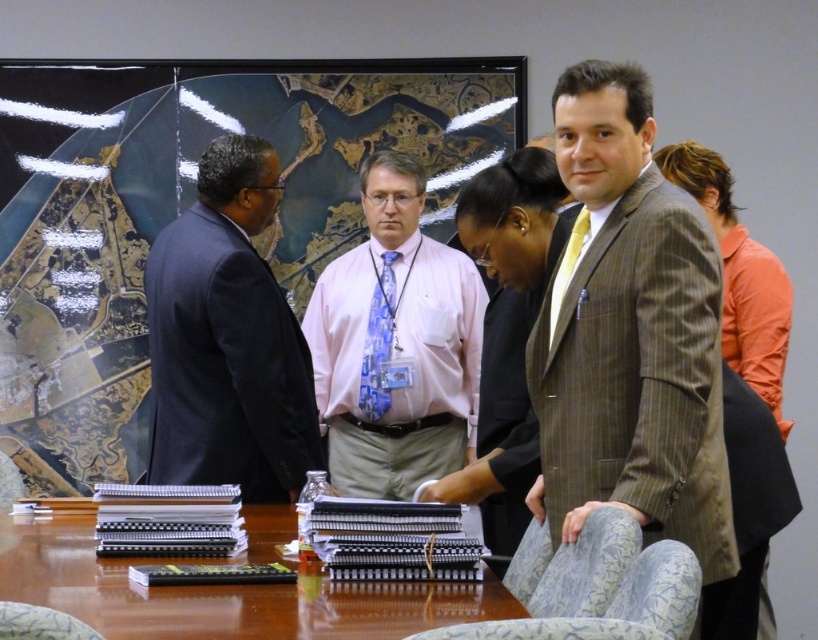
Is brown wooden table at center to the left of blue printed tie at center from the viewer's perspective?

Yes, brown wooden table at center is to the left of blue printed tie at center.

Can you confirm if brown wooden table at center is shorter than blue printed tie at center?

Indeed, brown wooden table at center has a lesser height compared to blue printed tie at center.

Between point (36, 592) and point (392, 301), which one is positioned in front?

Point (36, 592) is in front.

I want to click on brown wooden table at center, so click(225, 589).

Can you confirm if brown pinstripe suit at center is positioned below yellow silk tie at center?

Yes.

Between point (576, 285) and point (576, 228), which one is positioned behind?

The point (576, 228) is more distant.

Does point (713, 413) come behind point (558, 310)?

No, (713, 413) is closer to viewer.

Find the location of a particular element. The height and width of the screenshot is (640, 818). brown pinstripe suit at center is located at coordinates (632, 342).

Looking at this image, who is shorter, dark blue suit at left or brown wooden table at center?

brown wooden table at center is shorter.

Is point (297, 492) less distant than point (183, 634)?

No, it is not.

Where is `dark blue suit at left`? Image resolution: width=818 pixels, height=640 pixels. dark blue suit at left is located at coordinates [x=227, y=339].